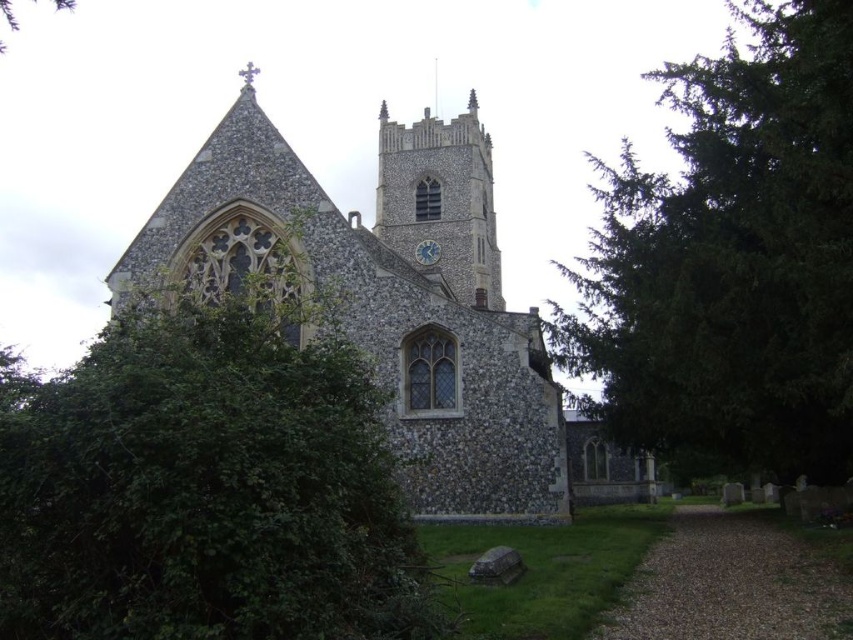
Question: Among these objects, which one is farthest from the camera?

Choices:
 (A) stone church at center
 (B) green textured tree at right
 (C) blue glass clock at upper center
 (D) green leafy bush at left

Answer: (C)

Question: Which is nearer to the blue glass clock at upper center?

Choices:
 (A) green leafy bush at left
 (B) stone clock tower at center
 (C) stone church at center

Answer: (B)

Question: Considering the real-world distances, which object is farthest from the stone clock tower at center?

Choices:
 (A) green leafy bush at left
 (B) blue glass clock at upper center

Answer: (A)

Question: Does green textured tree at right appear on the right side of stone church at center?

Choices:
 (A) yes
 (B) no

Answer: (A)

Question: Is green leafy bush at left positioned in front of blue glass clock at upper center?

Choices:
 (A) yes
 (B) no

Answer: (A)

Question: Can you confirm if green textured tree at right is wider than blue glass clock at upper center?

Choices:
 (A) yes
 (B) no

Answer: (A)